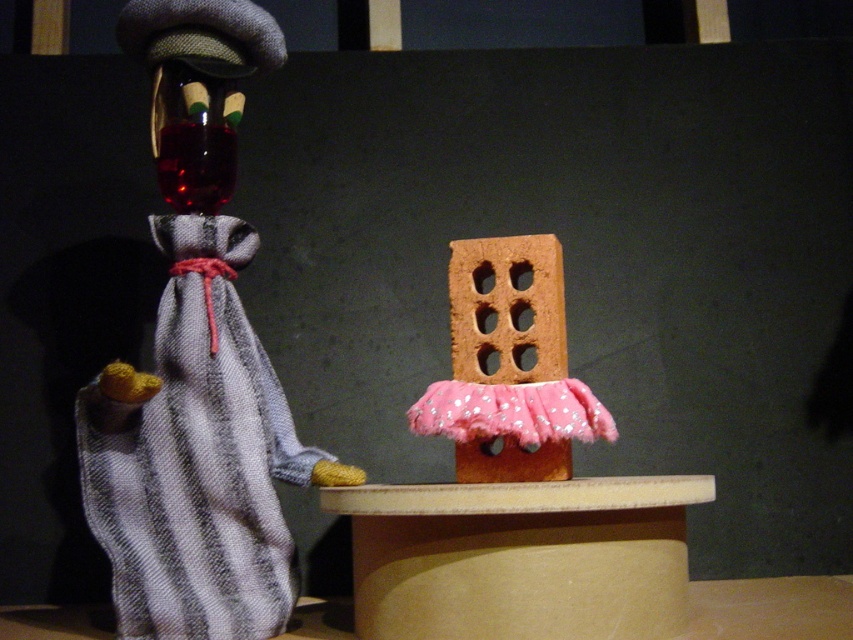
Question: Is striped fabric doll at left positioned in front of pink felt brick at center?

Choices:
 (A) yes
 (B) no

Answer: (A)

Question: Among these objects, which one is farthest from the camera?

Choices:
 (A) pink felt brick at center
 (B) striped fabric doll at left

Answer: (A)

Question: Observing the image, what is the correct spatial positioning of striped fabric doll at left in reference to pink felt brick at center?

Choices:
 (A) below
 (B) above

Answer: (B)

Question: Which object is farther from the camera taking this photo?

Choices:
 (A) striped fabric doll at left
 (B) pink felt brick at center

Answer: (B)

Question: Which point is farther from the camera taking this photo?

Choices:
 (A) (523, 394)
 (B) (247, 568)

Answer: (B)

Question: Does striped fabric doll at left appear over pink felt brick at center?

Choices:
 (A) no
 (B) yes

Answer: (B)